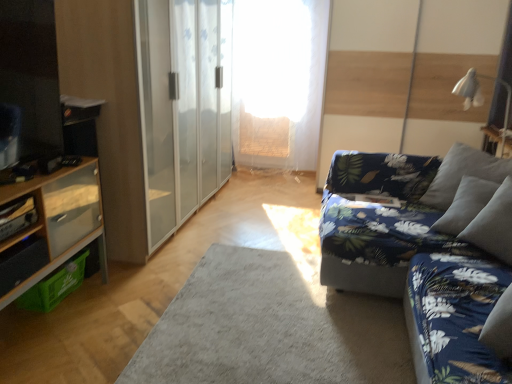
You are a GUI agent. You are given a task and a screenshot of the screen. Output one action in this format:
    pyautogui.click(x=<x>, y=<y>)
    Task: Click on the free space between wooden cabinet at left and gray soft rug at center
    
    Given the screenshot: What is the action you would take?
    pyautogui.click(x=125, y=309)